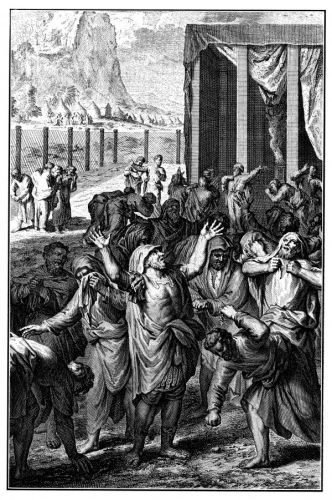
The width and height of the screenshot is (332, 500). In order to click on hood in this screenshot , I will do `click(138, 259)`.